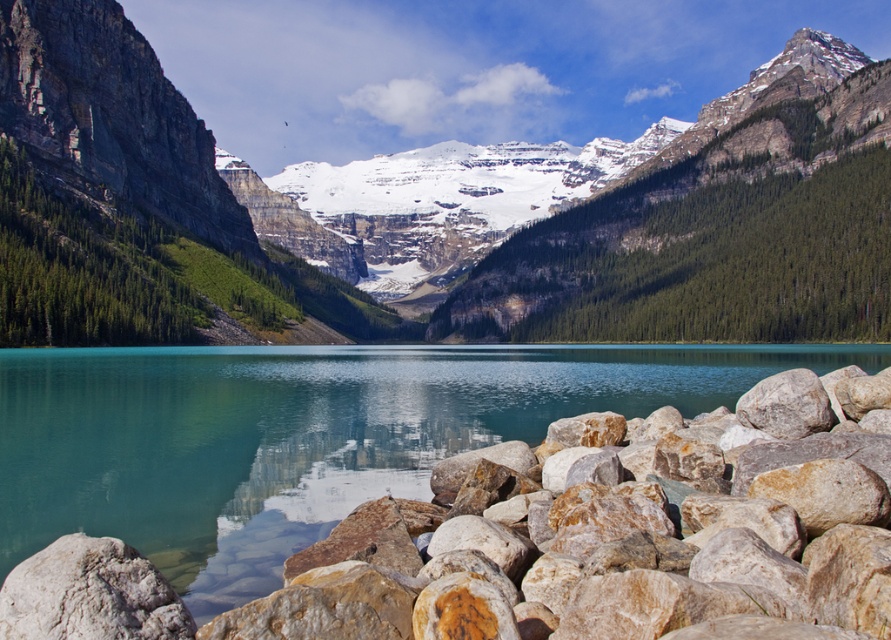
Is snowy rocky mountain at center further to camera compared to rusty rock at lower right?

Yes, it is.

Is point (609, 141) positioned in front of point (68, 406)?

No, (609, 141) is behind (68, 406).

You are a GUI agent. You are given a task and a screenshot of the screen. Output one action in this format:
    pyautogui.click(x=<x>, y=<y>)
    Task: Click on the snowy rocky mountain at center
    This screenshot has height=640, width=891.
    Given the screenshot: What is the action you would take?
    pyautogui.click(x=511, y=196)